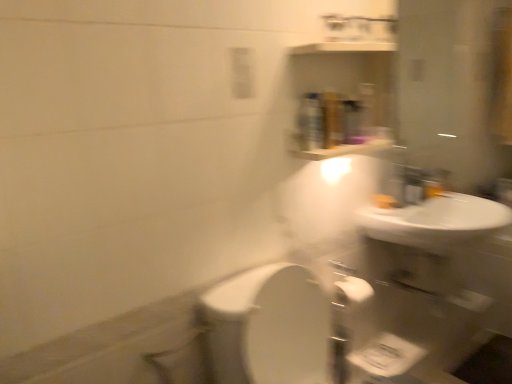
Question: From the image's perspective, is white glossy sink at upper right positioned above or below matte silver faucet at upper right?

Choices:
 (A) above
 (B) below

Answer: (B)

Question: Considering the positions of white glossy sink at upper right and matte silver faucet at upper right in the image, is white glossy sink at upper right taller or shorter than matte silver faucet at upper right?

Choices:
 (A) tall
 (B) short

Answer: (A)

Question: From a real-world perspective, is white glossy sink at upper right above or below matte silver faucet at upper right?

Choices:
 (A) below
 (B) above

Answer: (A)

Question: From a real-world perspective, is matte silver faucet at upper right physically located above or below white glossy sink at upper right?

Choices:
 (A) above
 (B) below

Answer: (A)

Question: Is point (408, 198) positioned closer to the camera than point (396, 233)?

Choices:
 (A) closer
 (B) farther

Answer: (B)

Question: Is matte silver faucet at upper right to the left or to the right of white glossy sink at upper right in the image?

Choices:
 (A) left
 (B) right

Answer: (A)

Question: Considering the positions of matte silver faucet at upper right and white glossy sink at upper right in the image, is matte silver faucet at upper right bigger or smaller than white glossy sink at upper right?

Choices:
 (A) big
 (B) small

Answer: (B)